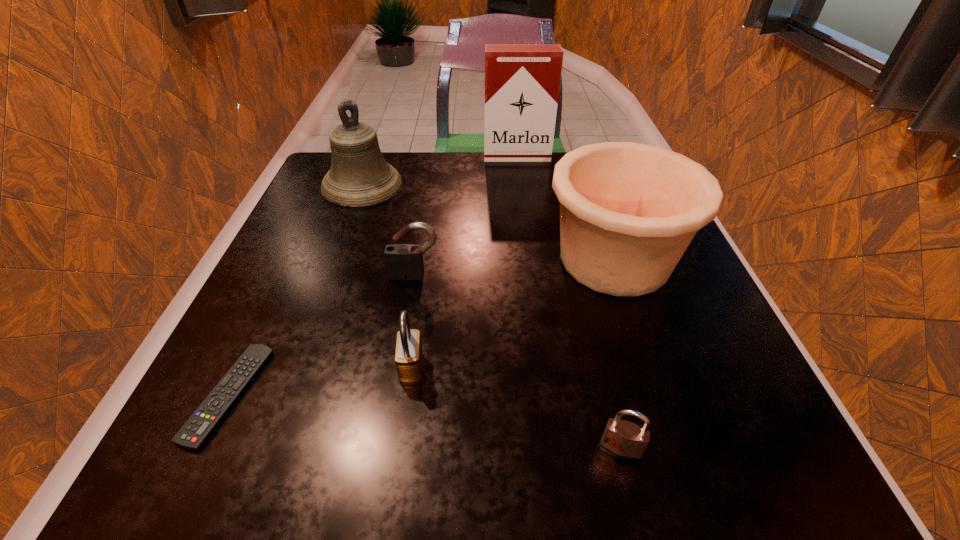
Image resolution: width=960 pixels, height=540 pixels. I want to click on cigarette_case, so click(522, 81).

The image size is (960, 540). I want to click on the tallest object, so click(522, 81).

You are a GUI agent. You are given a task and a screenshot of the screen. Output one action in this format:
    pyautogui.click(x=<x>, y=<y>)
    Task: Click on the bell
    The image size is (960, 540).
    Given the screenshot: What is the action you would take?
    pyautogui.click(x=359, y=176)

Image resolution: width=960 pixels, height=540 pixels. In order to click on pottery in this screenshot , I will do `click(628, 211)`.

What are the coordinates of `the farthest padlock` in the screenshot? It's located at (402, 260).

Where is `the second nearest padlock`? the second nearest padlock is located at coordinates (408, 357).

In order to click on the shortest padlock in this screenshot , I will do `click(623, 440)`.

You are a GUI agent. You are given a task and a screenshot of the screen. Output one action in this format:
    pyautogui.click(x=<x>, y=<y>)
    Task: Click on the rightmost padlock
    Image resolution: width=960 pixels, height=540 pixels.
    Given the screenshot: What is the action you would take?
    pyautogui.click(x=623, y=440)

This screenshot has height=540, width=960. I want to click on remote control, so click(197, 430).

This screenshot has width=960, height=540. I want to click on free space located on the front-facing side of the farthest object, so click(519, 178).